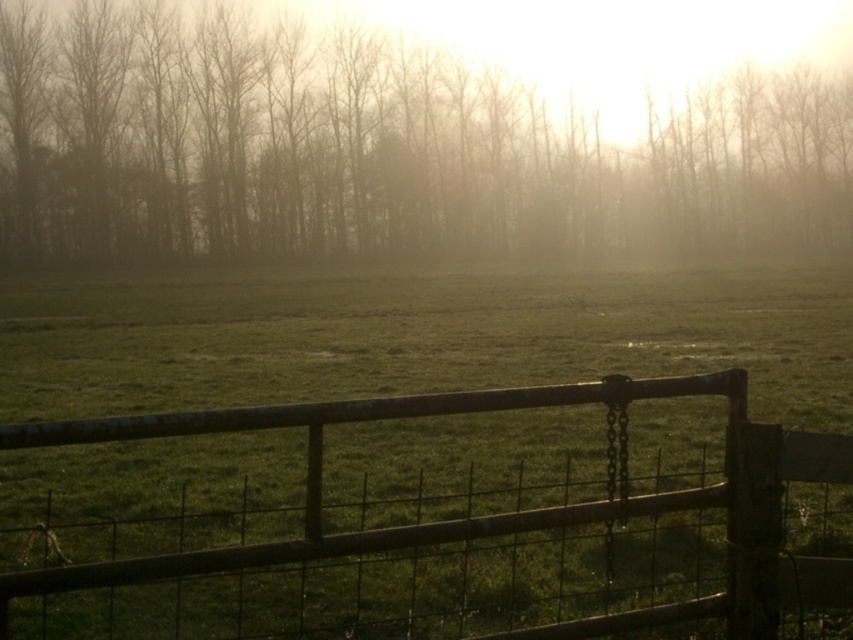
Question: Is silhouetted bare trees at upper center closer to the viewer compared to rusty wood gate at center?

Choices:
 (A) no
 (B) yes

Answer: (A)

Question: Which point appears closest to the camera in this image?

Choices:
 (A) (126, 420)
 (B) (529, 212)

Answer: (A)

Question: Is silhouetted bare trees at upper center positioned behind rusty wood gate at center?

Choices:
 (A) no
 (B) yes

Answer: (B)

Question: Which point appears farthest from the camera in this image?

Choices:
 (A) [64, 234]
 (B) [140, 566]

Answer: (A)

Question: Among these objects, which one is farthest from the camera?

Choices:
 (A) rusty wood gate at center
 (B) silhouetted bare trees at upper center

Answer: (B)

Question: Is silhouetted bare trees at upper center positioned in front of rusty wood gate at center?

Choices:
 (A) yes
 (B) no

Answer: (B)